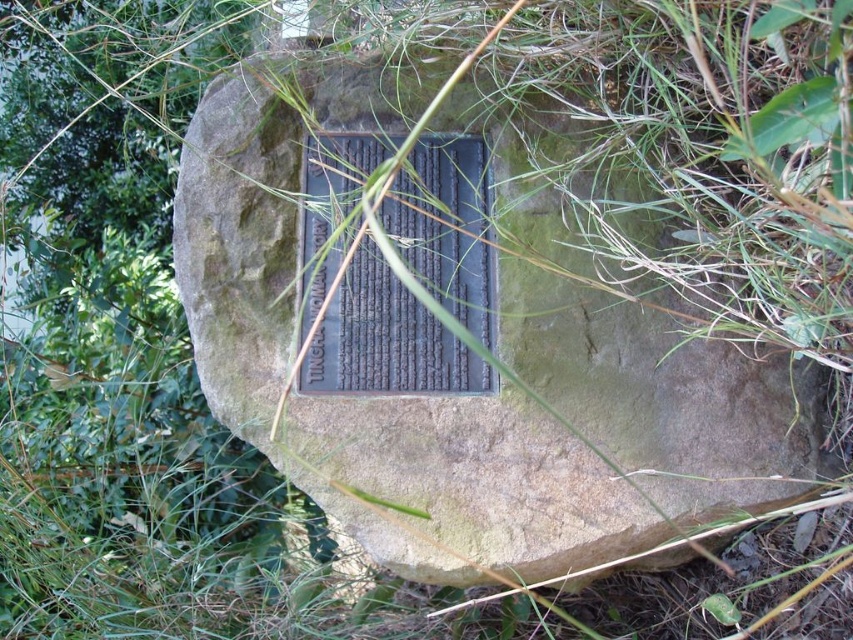
Question: Is bronze plaque at center behind black polished stone plaque at center?

Choices:
 (A) yes
 (B) no

Answer: (B)

Question: Does bronze plaque at center have a smaller size compared to black polished stone plaque at center?

Choices:
 (A) no
 (B) yes

Answer: (A)

Question: Among these points, which one is farthest from the camera?

Choices:
 (A) (460, 372)
 (B) (795, 497)

Answer: (A)

Question: Is bronze plaque at center to the left of black polished stone plaque at center from the viewer's perspective?

Choices:
 (A) no
 (B) yes

Answer: (A)

Question: Which point is farther to the camera?

Choices:
 (A) (461, 237)
 (B) (390, 333)

Answer: (A)